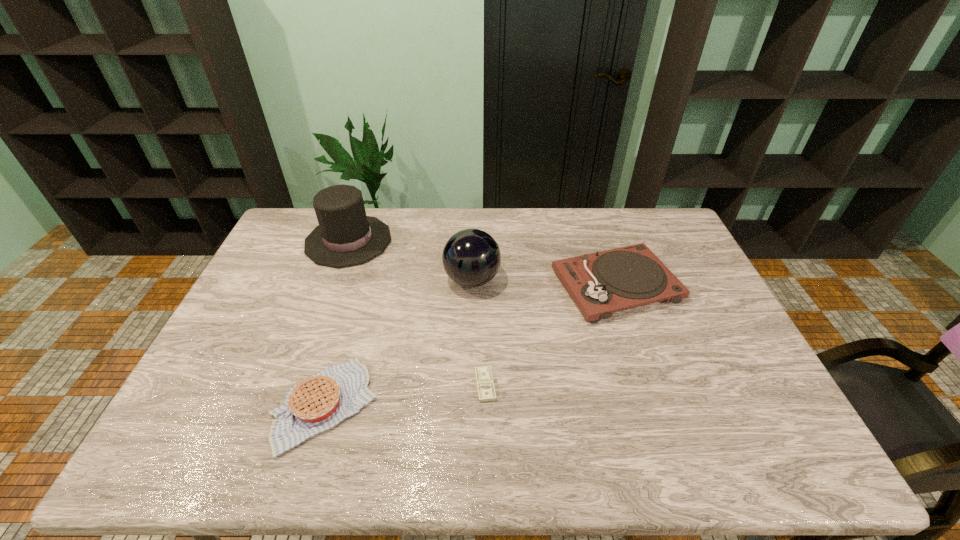
What are the coordinates of `vacant space located on the left of the money` in the screenshot? It's located at (370, 385).

Where is `object that is at the far edge`? The image size is (960, 540). object that is at the far edge is located at coordinates (346, 236).

The height and width of the screenshot is (540, 960). I want to click on object located in the near edge section of the desktop, so click(321, 401).

Identify the location of object that is at the left edge. The height and width of the screenshot is (540, 960). (346, 236).

You are a GUI agent. You are given a task and a screenshot of the screen. Output one action in this format:
    pyautogui.click(x=<x>, y=<y>)
    Task: Click on the object that is at the right edge
    
    Given the screenshot: What is the action you would take?
    pyautogui.click(x=601, y=283)

Find the location of `object positioned at the far left corner`. object positioned at the far left corner is located at coordinates (346, 236).

Locate an element on the screen. The width and height of the screenshot is (960, 540). free space at the far edge is located at coordinates (560, 234).

Where is `free space at the near edge`? The image size is (960, 540). free space at the near edge is located at coordinates (352, 443).

In the image, there is a desktop. Find the location of `vacant area at the left edge`. vacant area at the left edge is located at coordinates (238, 325).

This screenshot has height=540, width=960. What are the coordinates of `free space at the right edge of the desktop` in the screenshot? It's located at (726, 342).